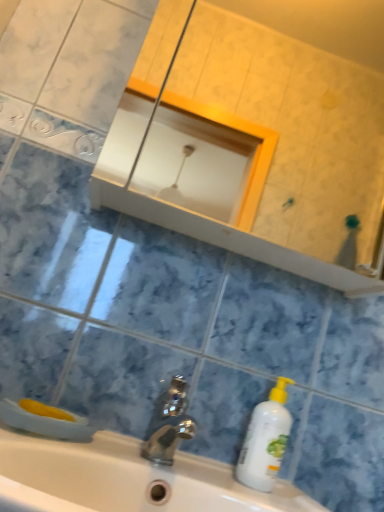
Image resolution: width=384 pixels, height=512 pixels. What do you see at coordinates (255, 138) in the screenshot?
I see `matte white mirror at upper center` at bounding box center [255, 138].

In order to face matte white mirror at upper center, should I rotate leftwards or rightwards?

A 14.534 degree turn to the right will do.

Where is `white glossy sink at center`? The width and height of the screenshot is (384, 512). white glossy sink at center is located at coordinates (126, 480).

Can you confirm if white plastic bottle at lower right is positioned to the right of polished metallic faucet at center?

Yes.

Is white plastic bottle at lower right positioned before polished metallic faucet at center?

No, it is not.

Is white plastic bottle at lower right positioned with its back to polished metallic faucet at center?

white plastic bottle at lower right is not turned away from polished metallic faucet at center.

Relative to white plastic bottle at lower right, is matte white mirror at upper center in front or behind?

In the image, matte white mirror at upper center appears in front of white plastic bottle at lower right.

From the picture: Which of these two, matte white mirror at upper center or white plastic bottle at lower right, is wider?

matte white mirror at upper center is wider.

Which is more to the left, matte white mirror at upper center or white plastic bottle at lower right?

white plastic bottle at lower right.

Is the surface of matte white mirror at upper center in direct contact with white plastic bottle at lower right?

matte white mirror at upper center is not next to white plastic bottle at lower right, and they're not touching.

Is white plastic bottle at lower right closer to the viewer compared to white glossy sink at center?

No, white plastic bottle at lower right is behind white glossy sink at center.

Does white plastic bottle at lower right contain white glossy sink at center?

That's incorrect, white glossy sink at center is not inside white plastic bottle at lower right.

Is point (277, 397) farther from camera compared to point (118, 455)?

Yes, it is behind point (118, 455).

Does white plastic bottle at lower right turn towards white glossy sink at center?

No, white plastic bottle at lower right is not oriented towards white glossy sink at center.

Considering the relative sizes of matte white mirror at upper center and polished metallic faucet at center in the image provided, is matte white mirror at upper center wider than polished metallic faucet at center?

Yes, matte white mirror at upper center is wider than polished metallic faucet at center.

Which object is closer to the camera, matte white mirror at upper center or polished metallic faucet at center?

polished metallic faucet at center.

Considering the sizes of objects matte white mirror at upper center and polished metallic faucet at center in the image provided, who is shorter, matte white mirror at upper center or polished metallic faucet at center?

Standing shorter between the two is polished metallic faucet at center.

The width and height of the screenshot is (384, 512). In order to click on tap below the matte white mirror at upper center (from the image's perspective) in this screenshot , I will do `click(168, 424)`.

Which is in front, point (175, 408) or point (11, 437)?

The point (11, 437) is in front.

Is polished metallic faucet at center facing towards white glossy sink at center?

No, polished metallic faucet at center is not facing towards white glossy sink at center.

Image resolution: width=384 pixels, height=512 pixels. In the image, there is a white glossy sink at center. Identify the location of tap above it (from the image's perspective). (168, 424).

Consider the image. Is white glossy sink at center bigger or smaller than white plastic bottle at lower right?

In the image, white glossy sink at center appears to be larger than white plastic bottle at lower right.

Consider the image. Between white glossy sink at center and white plastic bottle at lower right, which one has less height?

With less height is white glossy sink at center.

Is white glossy sink at center positioned far away from white plastic bottle at lower right?

No, white glossy sink at center is in close proximity to white plastic bottle at lower right.

Which is correct: matte white mirror at upper center is inside white glossy sink at center, or outside of it?

matte white mirror at upper center is not enclosed by white glossy sink at center.

In the image, there is a white glossy sink at center. Where is `mirror above it (from the image's perspective)`? This screenshot has height=512, width=384. mirror above it (from the image's perspective) is located at coordinates (255, 138).

Is matte white mirror at upper center closer to the viewer compared to white glossy sink at center?

That is False.

Locate an element on the screen. This screenshot has width=384, height=512. tap above the white plastic bottle at lower right (from the image's perspective) is located at coordinates click(x=168, y=424).

At what (x,y) coordinates should I click in order to perform the action: click on mirror located in front of the white plastic bottle at lower right. Please return your answer as a coordinate pair (x, y). Looking at the image, I should click on (255, 138).

Looking at the image, which one is located further to white glossy sink at center, matte white mirror at upper center or white plastic bottle at lower right?

The object further to white glossy sink at center is matte white mirror at upper center.

Based on their spatial positions, is white glossy sink at center or polished metallic faucet at center further from matte white mirror at upper center?

polished metallic faucet at center lies further to matte white mirror at upper center than the other object.

Looking at the image, which one is located closer to white plastic bottle at lower right, matte white mirror at upper center or polished metallic faucet at center?

The object closer to white plastic bottle at lower right is polished metallic faucet at center.

Looking at the image, which one is located further to matte white mirror at upper center, polished metallic faucet at center or white glossy sink at center?

polished metallic faucet at center is further to matte white mirror at upper center.

Estimate the real-world distances between objects in this image. Which object is further from polished metallic faucet at center, white glossy sink at center or white plastic bottle at lower right?

The object further to polished metallic faucet at center is white plastic bottle at lower right.

From the image, which object appears to be farther from polished metallic faucet at center, matte white mirror at upper center or white glossy sink at center?

matte white mirror at upper center is positioned further to the anchor polished metallic faucet at center.

Estimate the real-world distances between objects in this image. Which object is closer to polished metallic faucet at center, white glossy sink at center or matte white mirror at upper center?

Among the two, white glossy sink at center is located nearer to polished metallic faucet at center.

Based on their spatial positions, is polished metallic faucet at center or white plastic bottle at lower right closer to white glossy sink at center?

Based on the image, polished metallic faucet at center appears to be nearer to white glossy sink at center.

Identify the location of tap between matte white mirror at upper center and white glossy sink at center from top to bottom. The height and width of the screenshot is (512, 384). (168, 424).

The width and height of the screenshot is (384, 512). In order to click on cleaning product between matte white mirror at upper center and white glossy sink at center from top to bottom in this screenshot , I will do `click(265, 440)`.

Locate an element on the screen. The width and height of the screenshot is (384, 512). tap that lies between matte white mirror at upper center and white plastic bottle at lower right from top to bottom is located at coordinates (168, 424).

Locate an element on the screen. This screenshot has width=384, height=512. tap between white glossy sink at center and white plastic bottle at lower right from front to back is located at coordinates (168, 424).